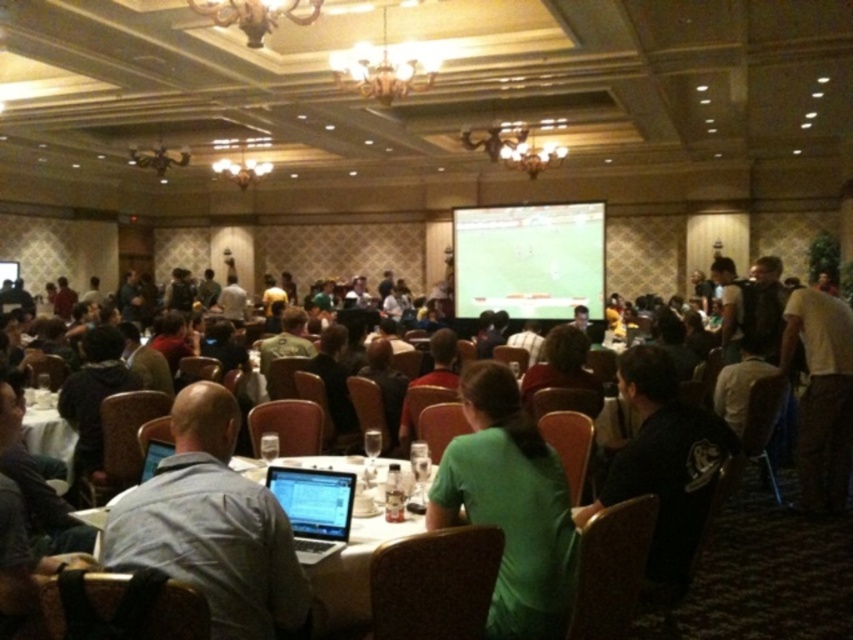
You are standing at the entrance of the conference room and see two points marked on the floor. The first point is labeled as point (231, 412) and the second is point (318, 595). If you want to walk from the entrance to the point that is closer to you, which point should you head towards?

Point (231, 412) is in front of point (318, 595), so you should head towards point (231, 412) as it is closer to you.

You are organizing a photo shoot in the conference room and need to ensure that both the gray fabric shirt at center and the green matte shirt at center are visible in the frame. Given their sizes, which shirt should you position closer to the camera to maintain visibility?

The gray fabric shirt at center is larger in size than the green matte shirt at center. To maintain visibility of both shirts, you should position the smaller green matte shirt at center closer to the camera so that its size appears more comparable to the larger gray fabric shirt at center in the photo.

You are organizing a conference and need to ensure that the gray fabric shirt at center can be placed on the white glossy table at center without overlapping its edges. Based on their sizes, is this possible?

The gray fabric shirt at center is narrower than the white glossy table at center, so it can be placed on the table without overlapping the edges.